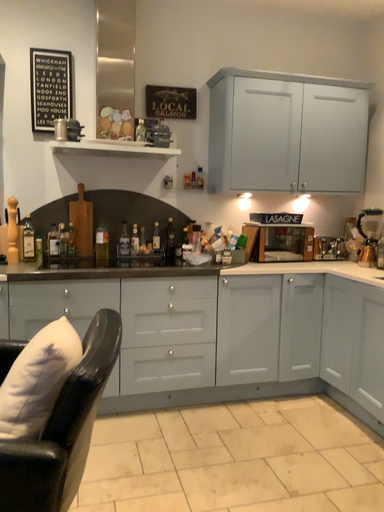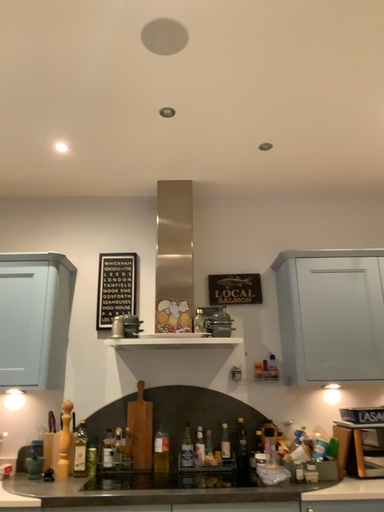
Question: How did the camera likely rotate when shooting the video?

Choices:
 (A) rotated left
 (B) rotated right

Answer: (A)